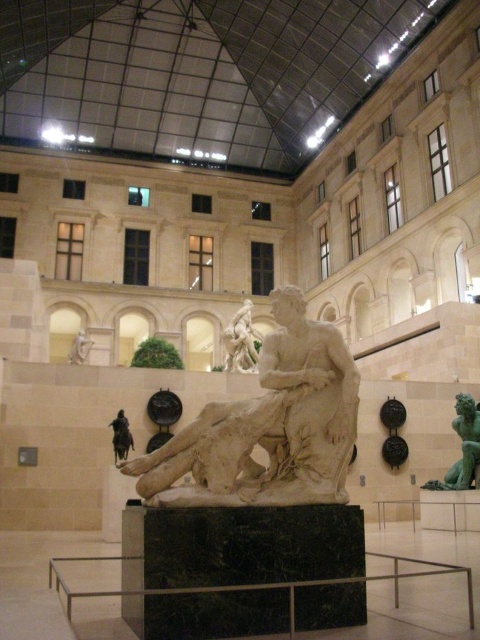
Question: Among these points, which one is nearest to the camera?

Choices:
 (A) (238, 365)
 (B) (431, 486)
 (C) (115, 426)
 (D) (76, 337)

Answer: (C)

Question: Which point is farther to the camera?

Choices:
 (A) white marble bust at upper left
 (B) marble statue at center

Answer: (B)

Question: Among these objects, which one is farthest from the camera?

Choices:
 (A) white marble statue at center
 (B) white marble bust at upper left
 (C) marble statue at center
 (D) green patina statue at right

Answer: (C)

Question: Is marble statue at center wider than black marble statue at lower left?

Choices:
 (A) yes
 (B) no

Answer: (A)

Question: Can you confirm if white marble statue at center is bigger than white marble bust at upper left?

Choices:
 (A) yes
 (B) no

Answer: (B)

Question: Is white marble statue at center wider than marble statue at center?

Choices:
 (A) no
 (B) yes

Answer: (B)